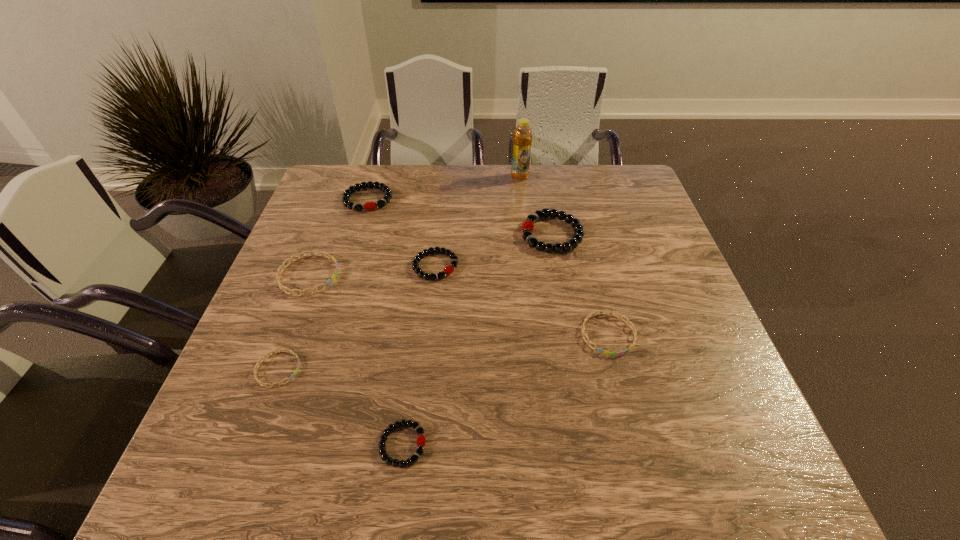
The image size is (960, 540). Find the location of `empty space that is in between the farthest blue bracelet and the rightmost blue bracelet`. empty space that is in between the farthest blue bracelet and the rightmost blue bracelet is located at coordinates (459, 305).

The width and height of the screenshot is (960, 540). I want to click on vacant region between the second biggest black bracelet and the third biggest black bracelet, so click(401, 233).

Choose which object is the fourth nearest neighbor to the seventh shortest object. Please provide its 2D coordinates. Your answer should be formatted as a tuple, i.e. [(x, y)], where the tuple contains the x and y coordinates of a point satisfying the conditions above.

[(348, 192)]

You are a GUI agent. You are given a task and a screenshot of the screen. Output one action in this format:
    pyautogui.click(x=<x>, y=<y>)
    Task: Click on the seventh closest object to the shortest object
    
    Given the screenshot: What is the action you would take?
    pyautogui.click(x=522, y=136)

At what (x,y) coordinates should I click in order to perform the action: click on the second closest bracelet to the farthest bracelet. Please return your answer as a coordinate pair (x, y). Looking at the image, I should click on (448, 270).

Locate which bracelet is the sixth closest to the farthest blue bracelet. Please provide its 2D coordinates. Your answer should be formatted as a tuple, i.e. [(x, y)], where the tuple contains the x and y coordinates of a point satisfying the conditions above.

[(584, 334)]

Choose which black bracelet is the third nearest neighbor to the smallest blue bracelet. Please provide its 2D coordinates. Your answer should be formatted as a tuple, i.e. [(x, y)], where the tuple contains the x and y coordinates of a point satisfying the conditions above.

[(348, 192)]

Locate which black bracelet ranks third in proximity to the leftmost black bracelet. Please provide its 2D coordinates. Your answer should be formatted as a tuple, i.e. [(x, y)], where the tuple contains the x and y coordinates of a point satisfying the conditions above.

[(421, 441)]

Locate which blue bracelet ranks third in proximity to the third biggest black bracelet. Please provide its 2D coordinates. Your answer should be formatted as a tuple, i.e. [(x, y)], where the tuple contains the x and y coordinates of a point satisfying the conditions above.

[(584, 334)]

Identify the location of blue bracelet that is the second closest one to the smallest blue bracelet. Image resolution: width=960 pixels, height=540 pixels. (584, 334).